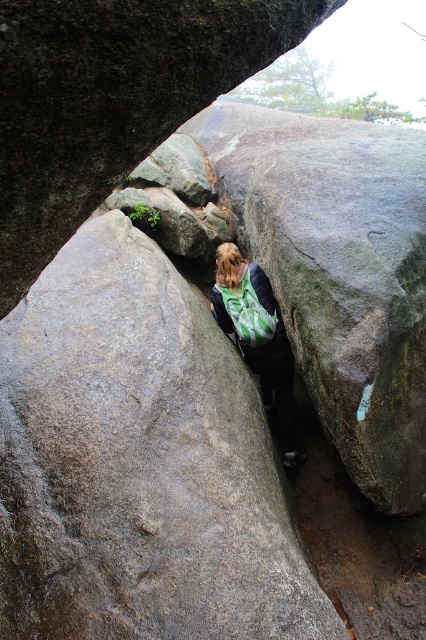
Question: Does gray rough boulder at center appear under green fabric backpack at center?

Choices:
 (A) yes
 (B) no

Answer: (B)

Question: Does gray rough boulder at center come in front of green fabric backpack at center?

Choices:
 (A) yes
 (B) no

Answer: (A)

Question: Which point appears closest to the camera in this image?

Choices:
 (A) (290, 404)
 (B) (235, 72)

Answer: (B)

Question: In this image, where is gray rough boulder at center located relative to green fabric backpack at center?

Choices:
 (A) left
 (B) right

Answer: (A)